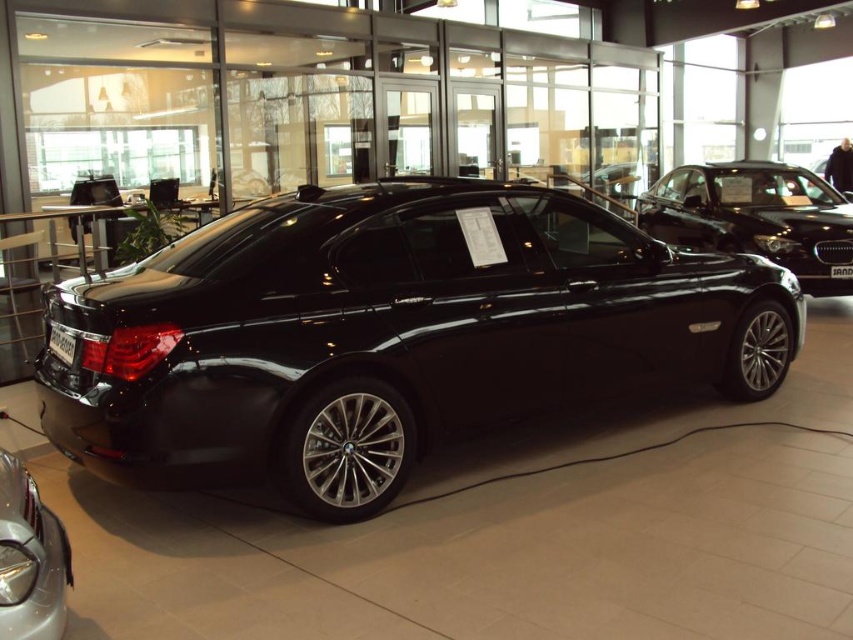
You are a showroom visitor who wants to take a photo of both the glossy black sedan at upper right and the metallic silver car at lower left in the same frame. Based on their positions, can you stand to the left of both cars to capture them in one shot?

The glossy black sedan at upper right is to the right of metallic silver car at lower left, so standing to the left of both cars would allow you to capture both in one shot since they are aligned horizontally.

You are a delivery person with a package that is 1.5 meters wide. You need to move it through the path between the black metallic car at center and the metallic silver car at lower left. Can you fit the package through that path?

The path between the black metallic car at center and the metallic silver car at lower left is 1.61 meters wide. Since the package is 1.5 meters wide, it can fit through the path as there is enough space.